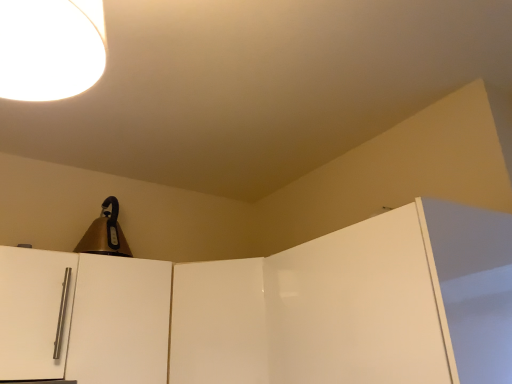
Question: From the image's perspective, is glossy white door at center, which appears as the second door when viewed from the right, positioned above or below white glossy lampshade at upper left?

Choices:
 (A) below
 (B) above

Answer: (A)

Question: In terms of size, does glossy white door at center, the 3th door in the left-to-right sequence, appear bigger or smaller than white glossy lampshade at upper left?

Choices:
 (A) big
 (B) small

Answer: (A)

Question: Based on their relative distances, which object is nearer to the glossy white door at center, the 3th door in the left-to-right sequence?

Choices:
 (A) glossy white door at upper right, the fourth door from the left
 (B) gold metallic bell at upper left
 (C) white glossy cabinet door at left, the 3th door from the right
 (D) satin white door handle at left, placed as the fourth door when sorted from right to left
 (E) white glossy lampshade at upper left

Answer: (C)

Question: Considering the real-world distances, which object is closest to the white glossy lampshade at upper left?

Choices:
 (A) glossy white door at upper right, the first door in the right-to-left sequence
 (B) white glossy cabinet door at left, which is the second door from left to right
 (C) glossy white door at center, the 3th door in the left-to-right sequence
 (D) satin white door handle at left, placed as the fourth door when sorted from right to left
 (E) gold metallic bell at upper left

Answer: (A)